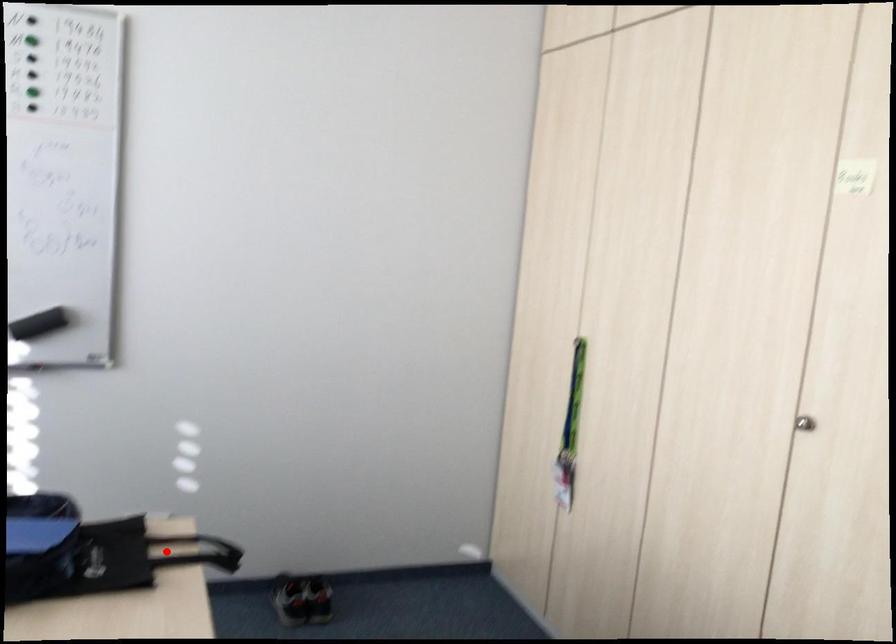
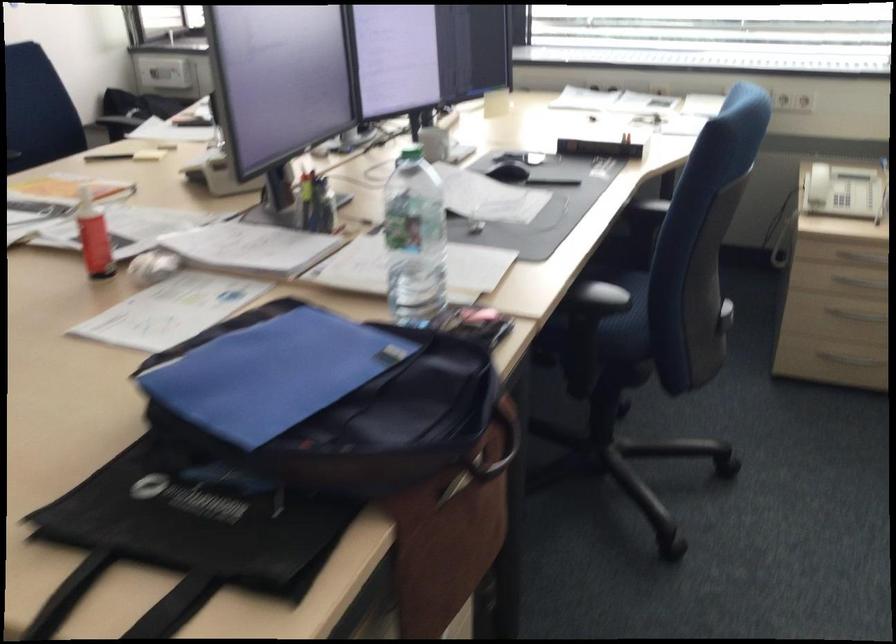
The point at the highlighted location is marked in the first image. Where is the corresponding point in the second image?

(124, 601)